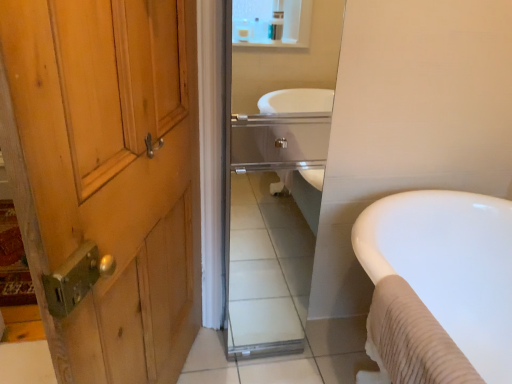
At what (x,y) coordinates should I click in order to perform the action: click on vacant space underneath glossy glass mirror at center (from a real-world perspective). Please return your answer as a coordinate pair (x, y). Looking at the image, I should click on coord(266,347).